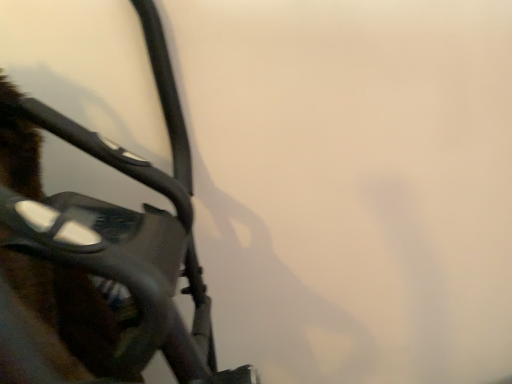
The image size is (512, 384). I want to click on matte black helmet at left, so click(x=99, y=254).

What do you see at coordinates (99, 254) in the screenshot?
I see `matte black helmet at left` at bounding box center [99, 254].

In order to face matte black helmet at left, should I rotate leftwards or rightwards?

Rotate right and turn 13.885 degrees.

The width and height of the screenshot is (512, 384). In order to click on matte black helmet at left in this screenshot , I will do `click(99, 254)`.